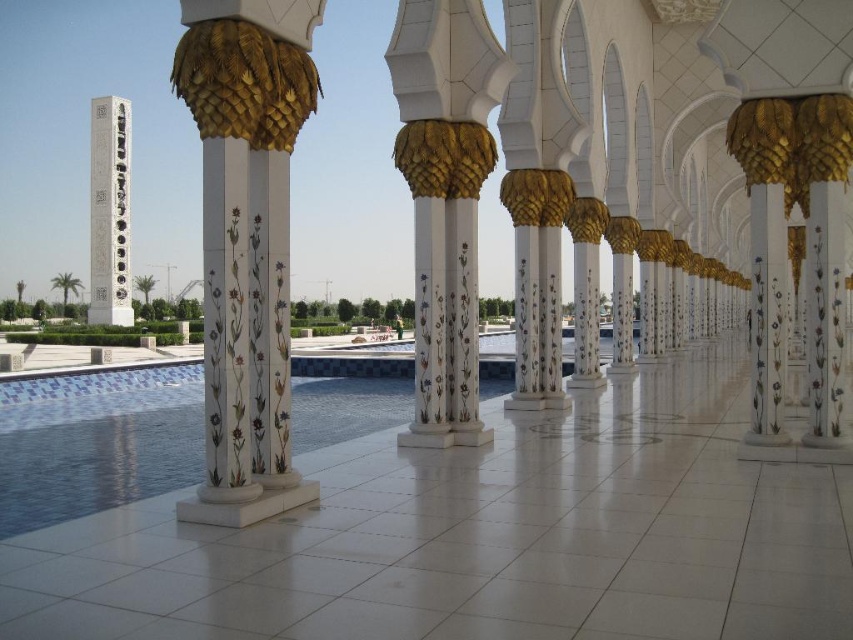
Can you confirm if white glossy column at center is shorter than white marble column at left?

Correct, white glossy column at center is not as tall as white marble column at left.

Does white glossy column at center appear on the left side of white marble column at left?

In fact, white glossy column at center is to the right of white marble column at left.

Measure the distance between white glossy column at center and camera.

A distance of 8.77 meters exists between white glossy column at center and camera.

What are the coordinates of `white glossy column at center` in the screenshot? It's located at (247, 243).

Who is more forward, [402,141] or [126,176]?

Point [402,141]

At what (x,y) coordinates should I click in order to perform the action: click on white marble pillar at center. Please return your answer as a coordinate pair (x, y). This screenshot has width=853, height=640. Looking at the image, I should click on (445, 200).

Is point (225, 465) positioned before point (468, 228)?

Yes, it is.

Is the position of white glossy column at center less distant than that of white marble pillar at center?

Yes, it is.

Does point (221, 412) come behind point (407, 80)?

No, it is not.

Identify the location of white glossy column at center. The image size is (853, 640). (247, 243).